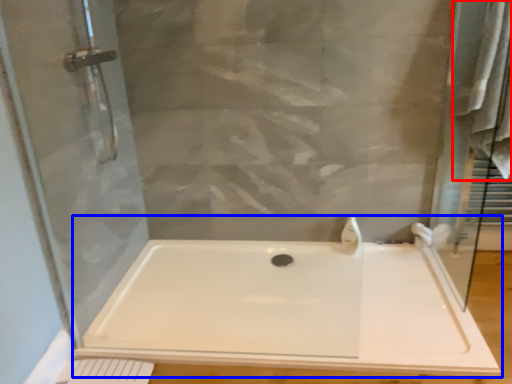
Question: Which point is closer to the camera, bath towel (highlighted by a red box) or bathtub (highlighted by a blue box)?

Choices:
 (A) bath towel
 (B) bathtub

Answer: (B)